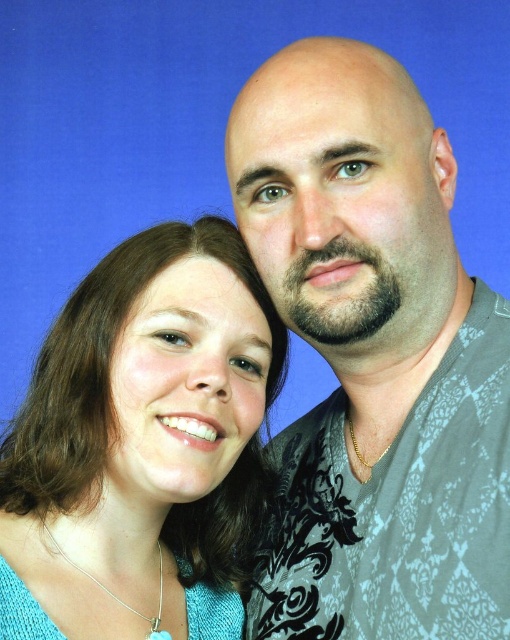
You are a photographer setting up for a portrait shoot. You notice the blue matte backdrop at upper center and the matte teal sweater at center. Which object is located to the left of the other?

The blue matte backdrop at upper center is positioned on the left side of matte teal sweater at center.

You are a photographer setting up for a portrait session. You notice the gray printed shirt at upper right and the matte teal sweater at center in the image. Which item is positioned closer to the right side of the frame?

The gray printed shirt at upper right is positioned closer to the right side of the frame compared to the matte teal sweater at center.

Based on the photo, you are standing 1 meter away from the image and want to touch the gray printed shirt at upper right. Is it within your reach?

The gray printed shirt at upper right is 64.95 centimeters away from the viewer, so yes, you can reach it since it is closer than 1 meter.